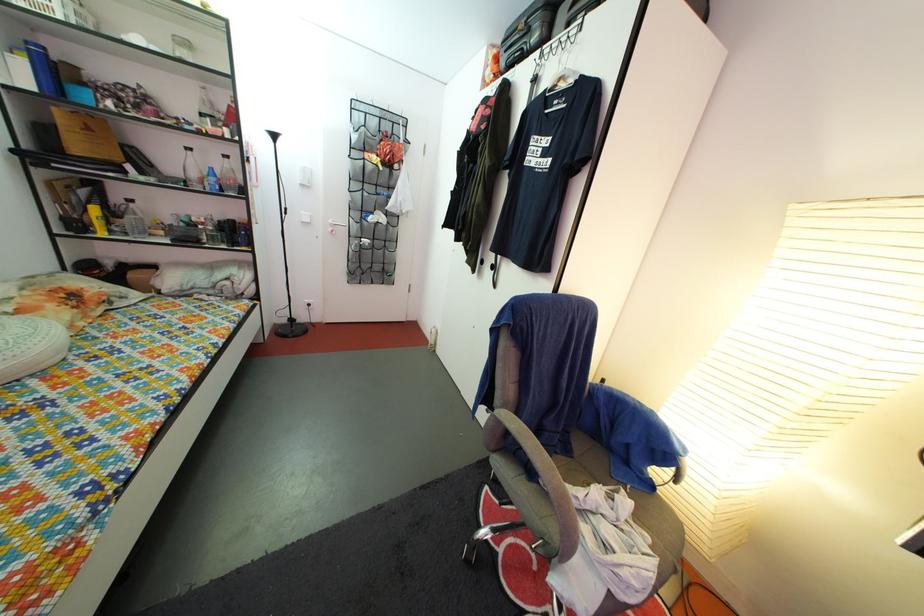
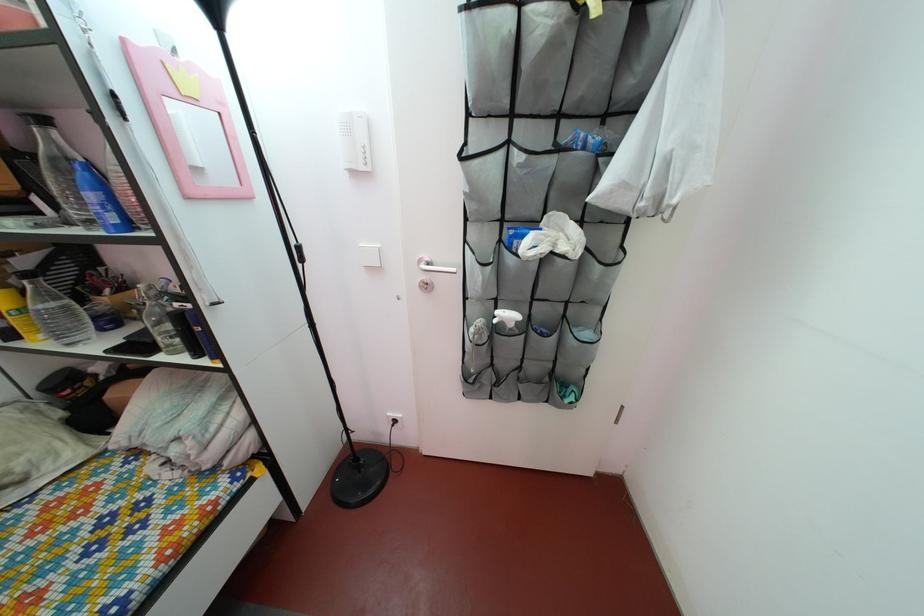
Where in the second image is the point corresponding to pixel 107 232 from the first image?

(27, 330)